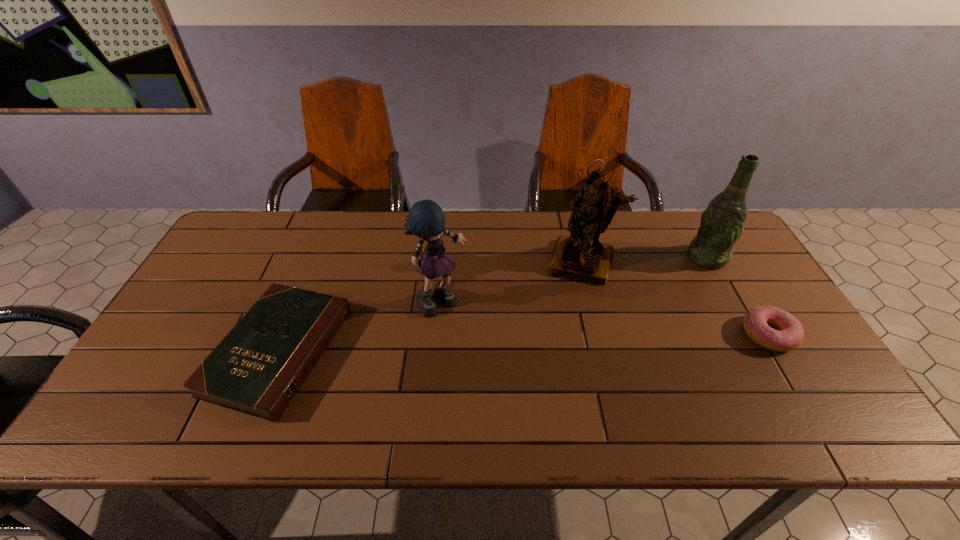
Locate an element on the screen. The height and width of the screenshot is (540, 960). free location located 0.060m on the front-facing side of the rag doll is located at coordinates (475, 325).

Where is `vacant space located 0.090m on the front-facing side of the rag doll`? The height and width of the screenshot is (540, 960). vacant space located 0.090m on the front-facing side of the rag doll is located at coordinates (483, 331).

At what (x,y) coordinates should I click in order to perform the action: click on vacant point located 0.100m on the front-facing side of the rag doll. Please return your answer as a coordinate pair (x, y). The image size is (960, 540). Looking at the image, I should click on (486, 333).

The width and height of the screenshot is (960, 540). What are the coordinates of `vacant region located on the front-facing side of the figurine` in the screenshot? It's located at (559, 338).

This screenshot has width=960, height=540. I want to click on free location located 0.390m on the front-facing side of the figurine, so click(x=542, y=396).

Find the location of a particular element. The image size is (960, 540). free location located on the front-facing side of the figurine is located at coordinates (570, 298).

Find the location of `beer bottle at the far edge`. beer bottle at the far edge is located at coordinates (722, 223).

In order to click on figurine located at the far edge in this screenshot , I will do `click(581, 256)`.

The width and height of the screenshot is (960, 540). I want to click on object located at the near edge, so click(259, 366).

Image resolution: width=960 pixels, height=540 pixels. Find the location of `object present at the left edge`. object present at the left edge is located at coordinates (259, 366).